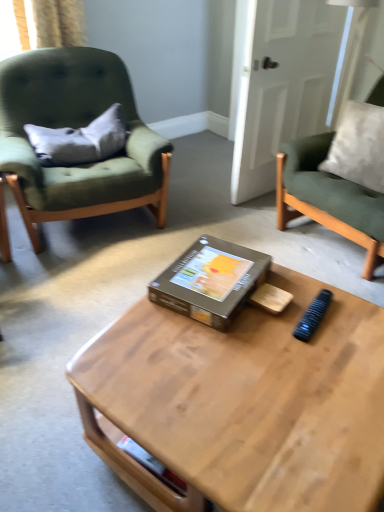
At what (x,y) coordinates should I click in order to perform the action: click on free point above brown cardboard box at center (from a real-world perspective). Please return your answer as a coordinate pair (x, y). Looking at the image, I should click on (220, 267).